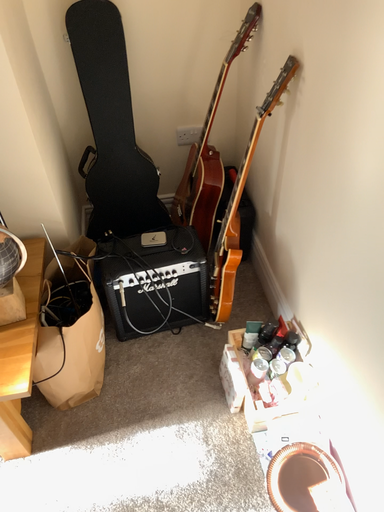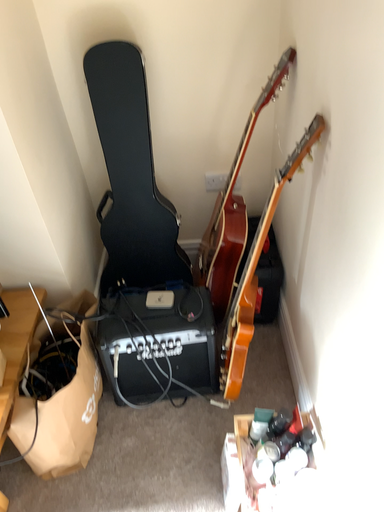
Question: Which way did the camera rotate in the video?

Choices:
 (A) rotated left
 (B) rotated right

Answer: (A)